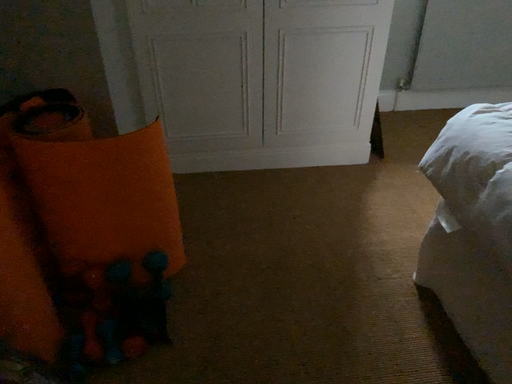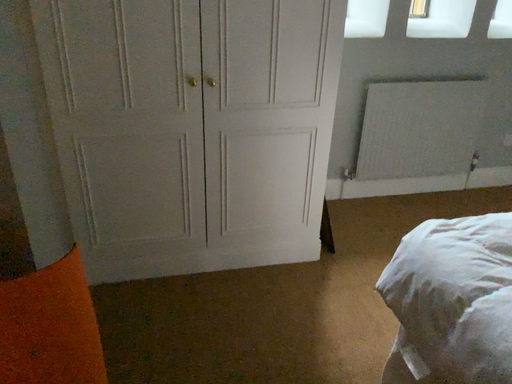
Question: How did the camera likely rotate when shooting the video?

Choices:
 (A) rotated right
 (B) rotated left

Answer: (A)